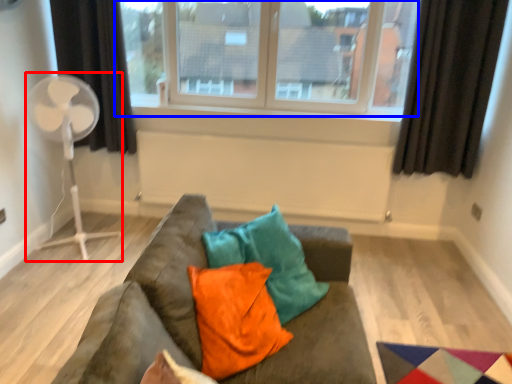
Question: Which of the following is the farthest to the observer, fan (highlighted by a red box) or window (highlighted by a blue box)?

Choices:
 (A) fan
 (B) window

Answer: (B)